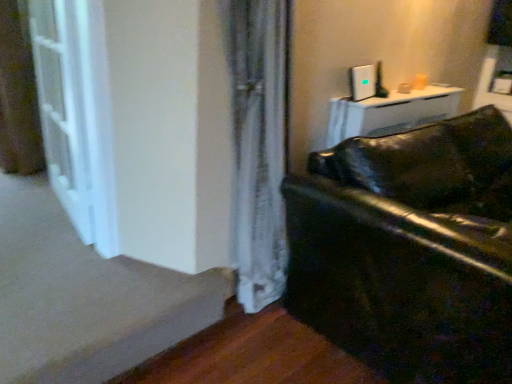
Question: From their relative heights in the image, would you say glossy black leather couch at lower right is taller or shorter than smooth beige carpet at lower left?

Choices:
 (A) short
 (B) tall

Answer: (B)

Question: Would you say glossy black leather couch at lower right is inside or outside smooth beige carpet at lower left?

Choices:
 (A) inside
 (B) outside

Answer: (B)

Question: Which object is the farthest from the smooth beige carpet at lower left?

Choices:
 (A) glossy black leather couch at lower right
 (B) white glossy screen door at left

Answer: (A)

Question: Which object is positioned closest to the glossy black leather couch at lower right?

Choices:
 (A) white glossy screen door at left
 (B) smooth beige carpet at lower left

Answer: (B)